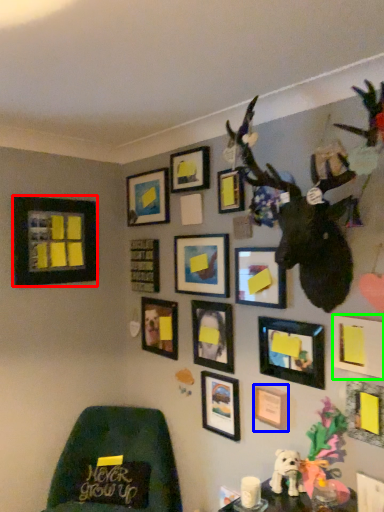
Question: Estimate the real-world distances between objects in this image. Which object is closer to picture frame (highlighted by a red box), picture frame (highlighted by a blue box) or picture frame (highlighted by a green box)?

Choices:
 (A) picture frame
 (B) picture frame

Answer: (A)